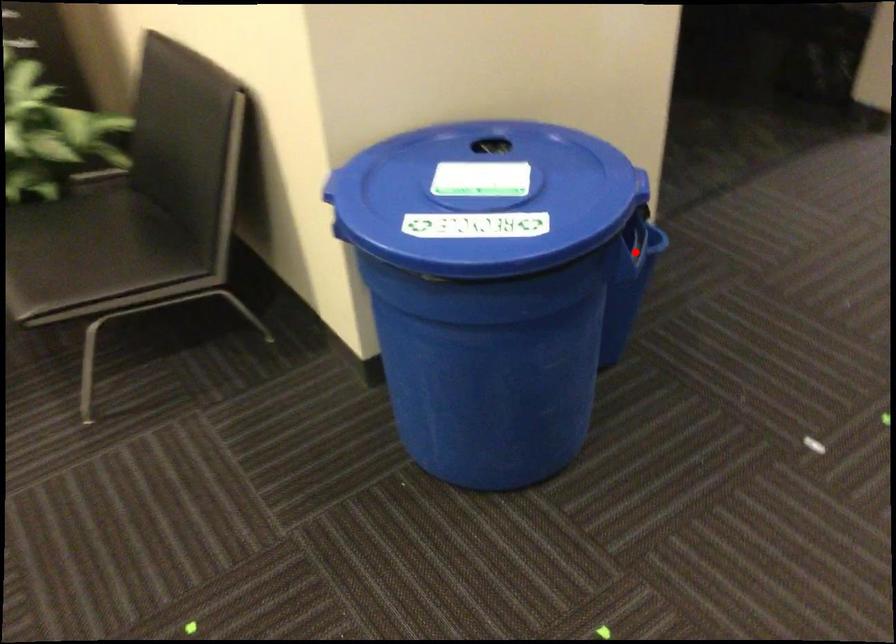
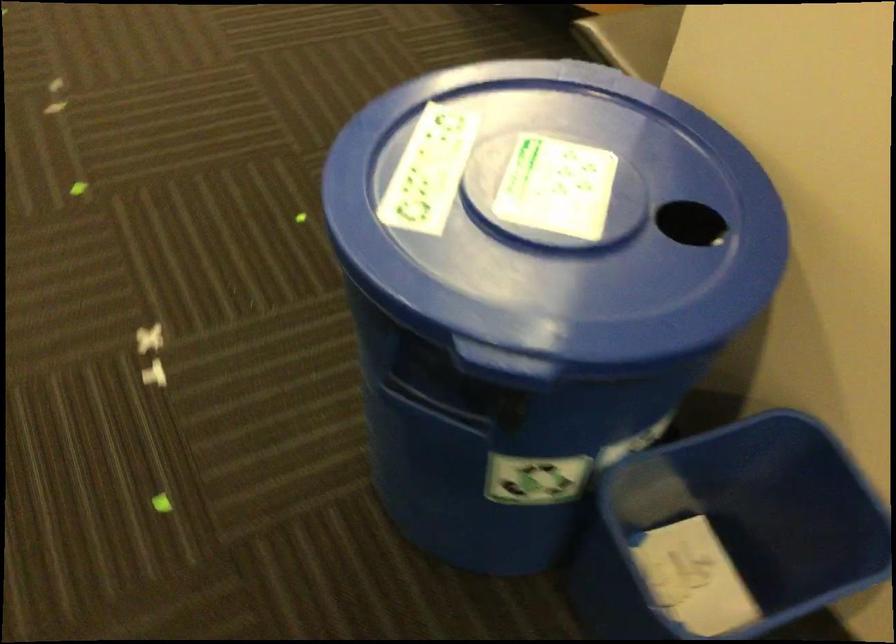
Find the pixel in the second image that matches the highlighted location in the first image.

(426, 406)